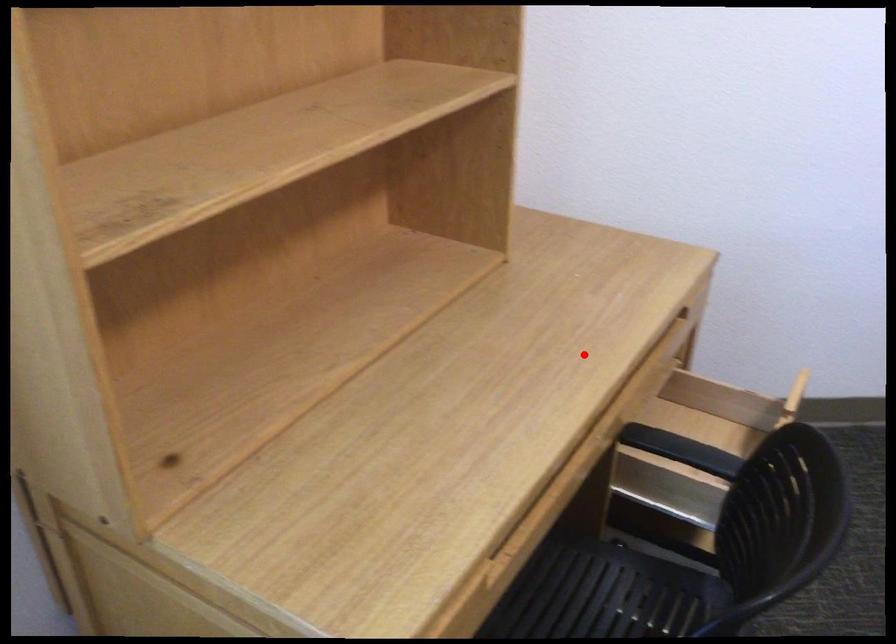
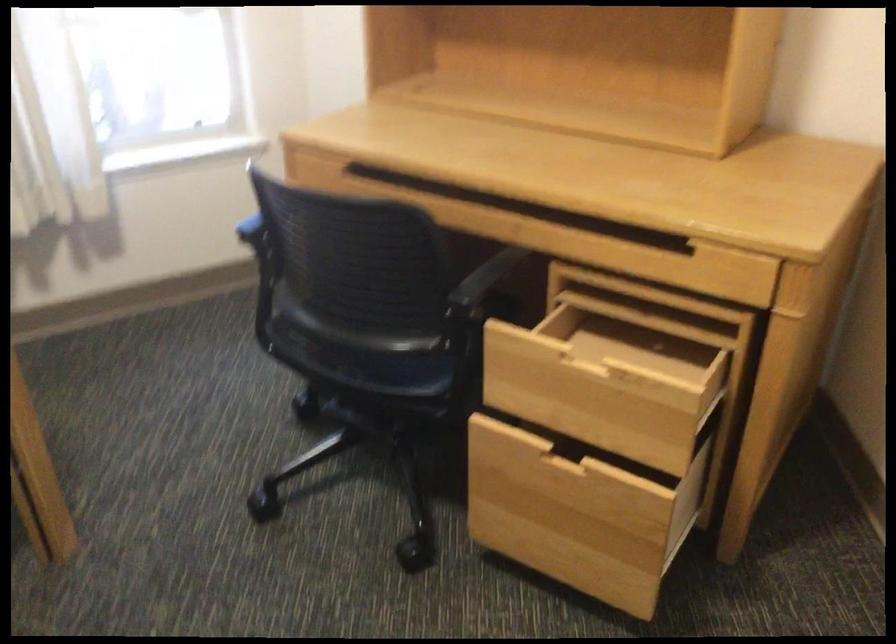
Question: I am providing you with two images of the same scene from different viewpoints. Given a red point in image1, look at the same physical point in image2. Is it:

Choices:
 (A) Closer to the viewpoint
 (B) Farther from the viewpoint

Answer: (B)